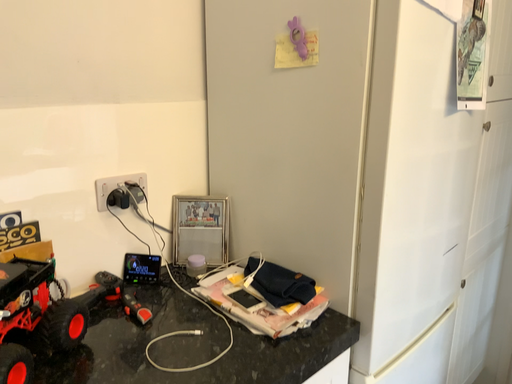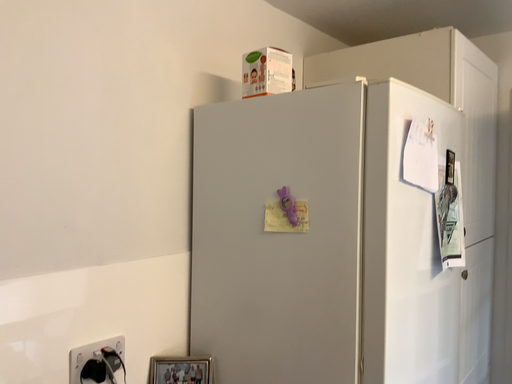
Question: How did the camera likely rotate when shooting the video?

Choices:
 (A) rotated upward
 (B) rotated downward

Answer: (A)